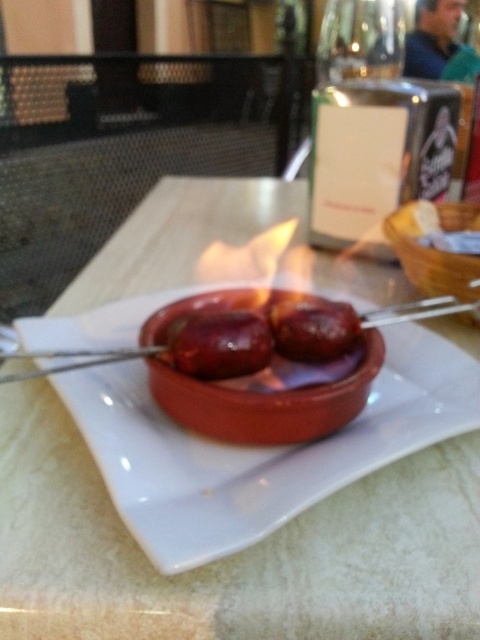
Looking at this image, you are a waiter in a busy restaurant and need to place both the matte ceramic plate at center and the matte clay bowl at center on a small tray that can only hold one of them. Which object should you choose to fit on the tray?

The matte clay bowl at center is smaller in size than the matte ceramic plate at center, so you should choose the matte clay bowl at center to fit on the tray.

You are a chef preparing a dish and need to place both the matte ceramic plate at center and the matte ceramic bowl at center on a shelf. The shelf has a height limit of 10 cm. Which item will exceed the height limit?

The matte ceramic bowl at center is taller than the matte ceramic plate at center. Since the shelf has a height limit of 10 cm, the matte ceramic bowl at center may exceed the limit, while the plate likely stays within it.